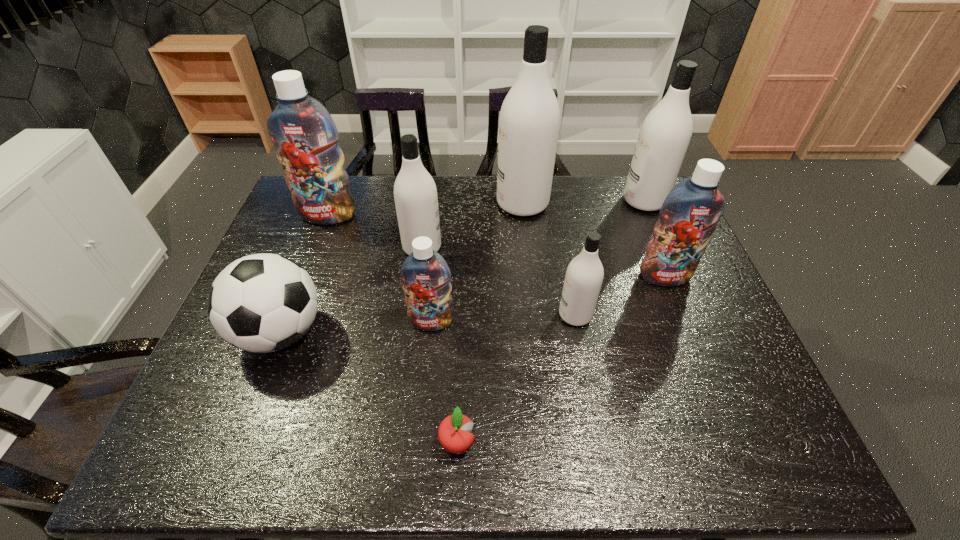
Find the location of a particular element. Image resolution: width=960 pixels, height=540 pixels. the smallest blue shampoo is located at coordinates (426, 276).

The image size is (960, 540). I want to click on the nearest blue shampoo, so click(426, 276).

Find the location of a particular element. This screenshot has height=540, width=960. soccer ball is located at coordinates (260, 303).

Identify the location of black soccer ball. This screenshot has width=960, height=540. (260, 303).

Locate an element on the screen. red apple is located at coordinates (454, 435).

The height and width of the screenshot is (540, 960). Find the location of `the shortest object`. the shortest object is located at coordinates coord(454,435).

The width and height of the screenshot is (960, 540). I want to click on free space located 0.320m on the front-facing side of the tallest object, so click(400, 204).

The width and height of the screenshot is (960, 540). I want to click on blank space located on the front-facing side of the tallest object, so click(x=389, y=204).

At what (x,y) coordinates should I click in order to perform the action: click on free space located 0.250m on the front-facing side of the tallest object. Please return your answer as a coordinate pair (x, y). This screenshot has height=540, width=960. Looking at the image, I should click on (421, 204).

The height and width of the screenshot is (540, 960). I want to click on free space located 0.200m on the front-facing side of the second biggest white shampoo, so click(564, 201).